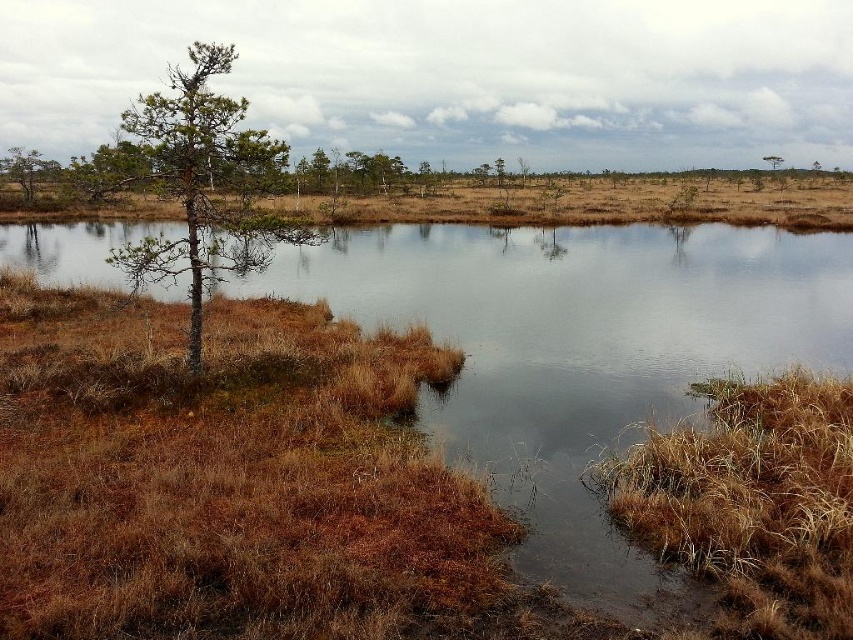
You are standing on the shore of the brown grassy lake at center and want to reach the green matte tree at upper right. Which direction should you head towards to get there?

To reach the green matte tree at upper right from the brown grassy lake at center, you should head towards the right since the green matte tree at upper right is located to the right of the lake.